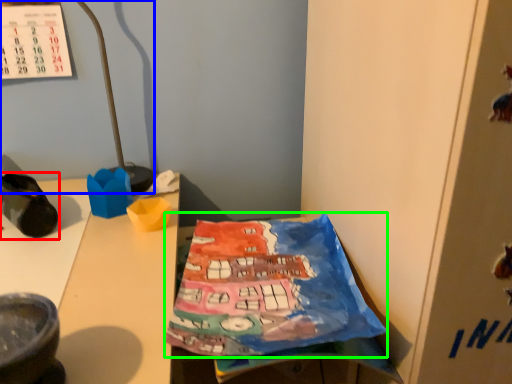
Question: Which object is the closest to the footwear (highlighted by a red box)? Choose among these: lamp (highlighted by a blue box) or wrapping paper (highlighted by a green box).

Choices:
 (A) lamp
 (B) wrapping paper

Answer: (A)